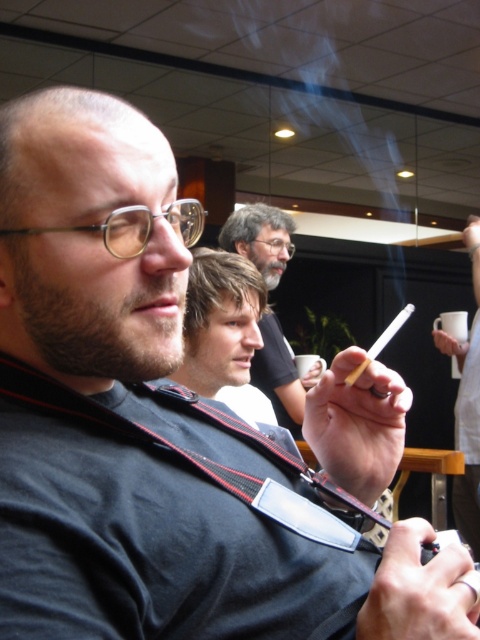
You are standing in the scene and want to reach both the point at coordinates point (372, 112) and point (468, 356). Which point should you reach first?

You should reach point (372, 112) first because it is closer to you than point (468, 356), which is further away.